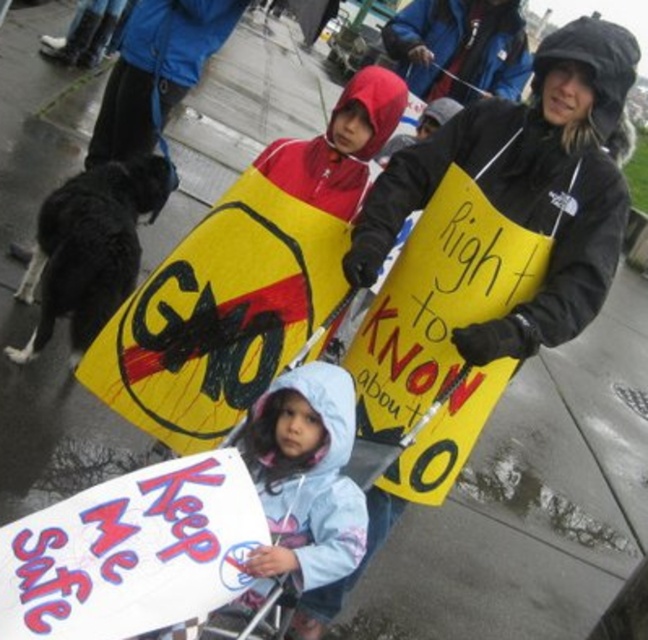
You are a photographer trying to capture the protest scene. You notice the yellow paper sign at center and the blue hooded jacket at upper center. Which object is closer to the camera? Explain your reasoning based on their positions in the scene.

The yellow paper sign at center is closer to the camera because it is positioned in front of the blue hooded jacket at upper center, meaning the sign is between the camera and the jacket.

You are a photographer trying to capture the protest scene. You notice the yellow paper sign at center and the light blue fabric jacket at center. Which object should you zoom in on to ensure both are visible in the frame without cropping? Explain your reasoning.

The yellow paper sign at center is wider than the light blue fabric jacket at center. To ensure both are visible without cropping, you should zoom in on the yellow paper sign at center since it has a larger width and will require more space in the frame.